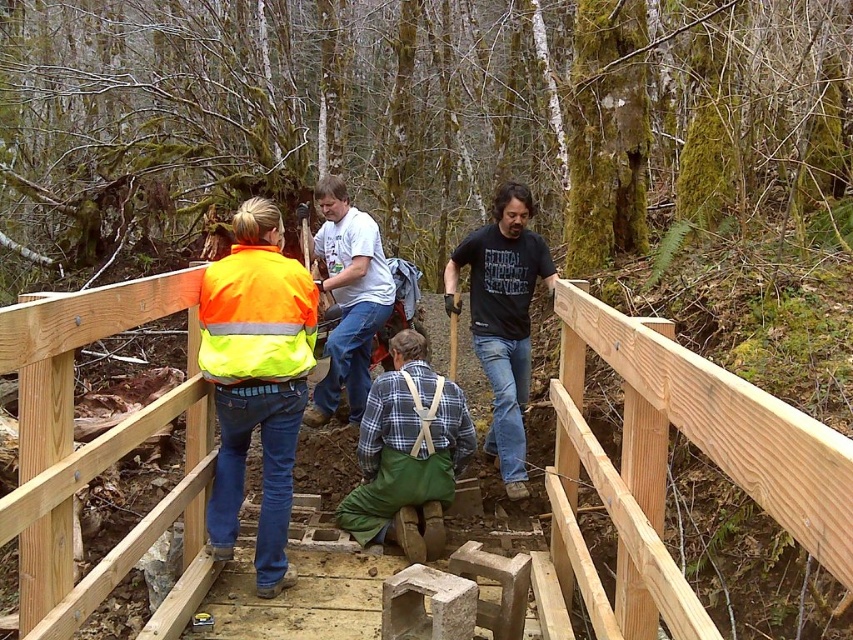
Question: Which object is farther from the camera taking this photo?

Choices:
 (A) white t-shirt at center
 (B) neon yellow reflective jacket at center
 (C) high visibility fabric safety vest at center
 (D) black cotton t-shirt at center

Answer: (A)

Question: Which point appears farthest from the camera in this image?

Choices:
 (A) (206, 272)
 (B) (323, 260)
 (C) (80, 588)
 (D) (465, 243)

Answer: (B)

Question: From the image, what is the correct spatial relationship of natural wood bridge at center in relation to neon yellow reflective jacket at center?

Choices:
 (A) above
 (B) below

Answer: (B)

Question: Is neon yellow reflective jacket at center smaller than high visibility fabric safety vest at center?

Choices:
 (A) no
 (B) yes

Answer: (A)

Question: Is the position of natural wood bridge at center more distant than that of neon yellow reflective jacket at center?

Choices:
 (A) yes
 (B) no

Answer: (B)

Question: Which point is closer to the camera?

Choices:
 (A) (851, 529)
 (B) (473, 280)
 (C) (344, 205)
 (D) (207, 358)

Answer: (A)